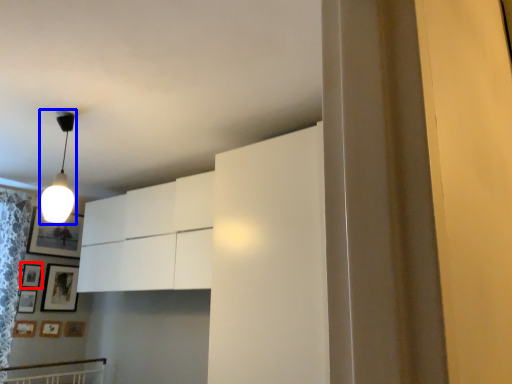
Question: Among these objects, which one is farthest to the camera, picture frame (highlighted by a red box) or lamp (highlighted by a blue box)?

Choices:
 (A) picture frame
 (B) lamp

Answer: (A)